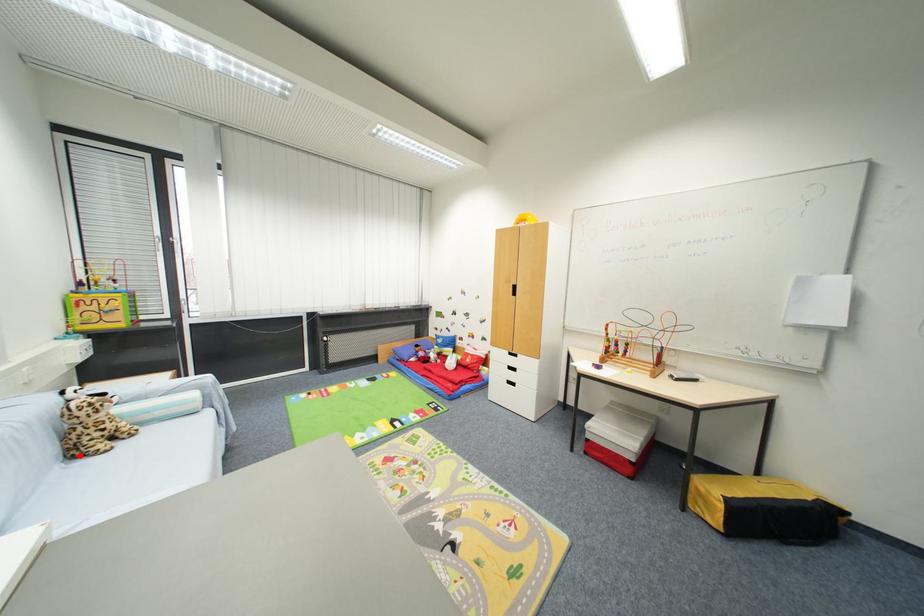
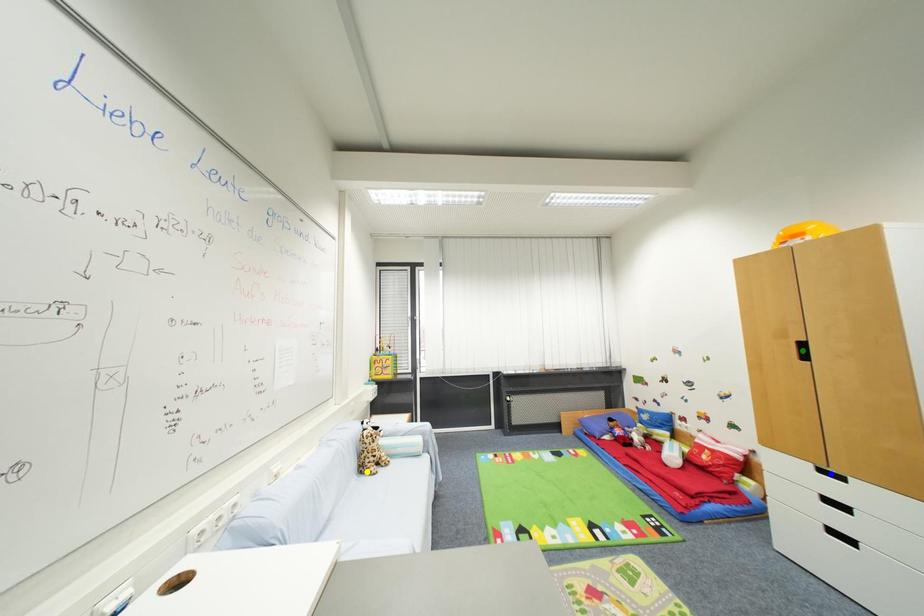
Question: I am providing you with two images of the same scene from different viewpoints. A red point is marked on the first image. You are given multiple points on the second image. Which mark in image 2 goes with the point in image 1?

Choices:
 (A) green point
 (B) yellow point
 (C) blue point

Answer: (B)